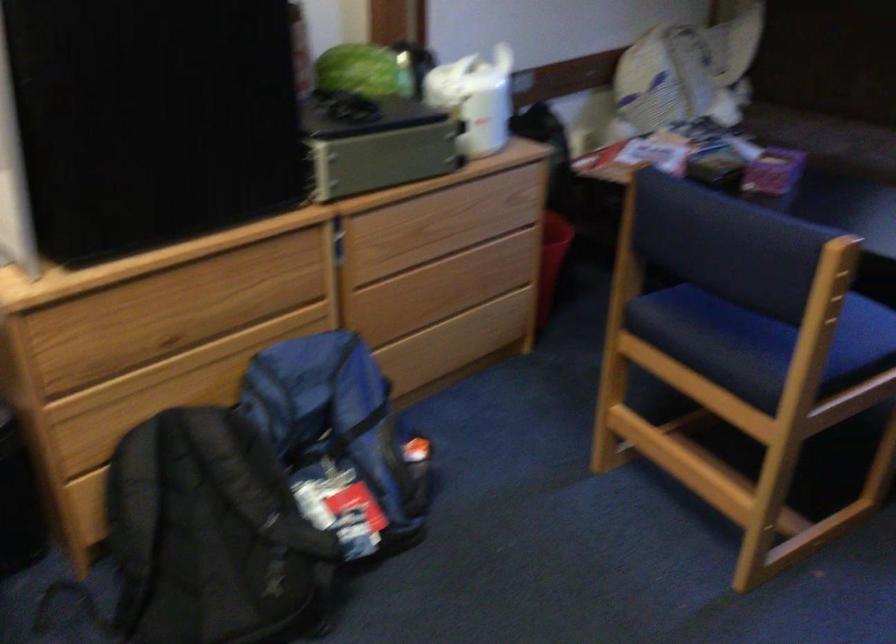
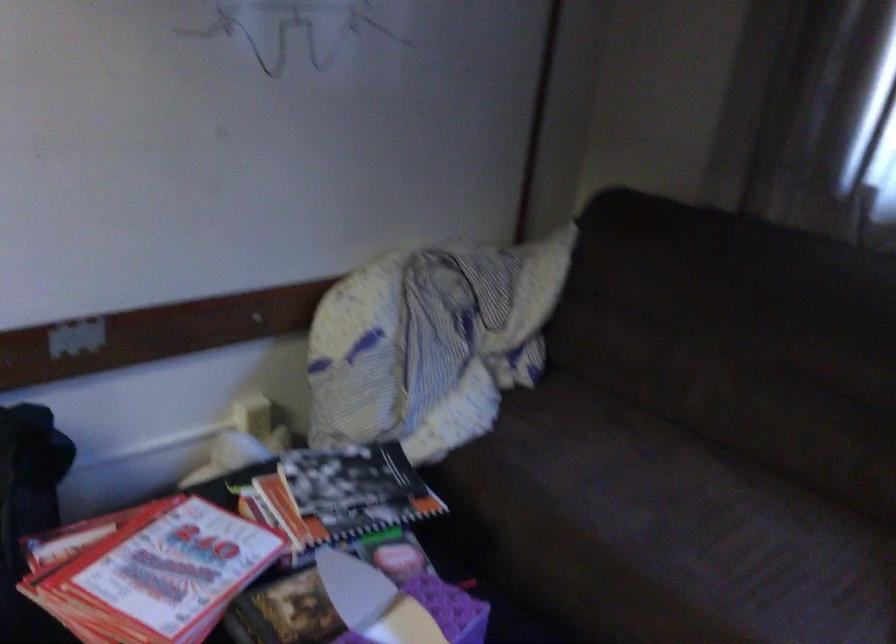
What movement of the cameraman would produce the second image?

The cameraman moved toward right, forward.